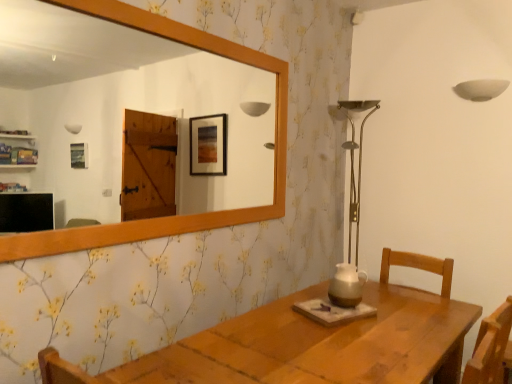
Question: Considering the relative sizes of wooden mirror at upper center and brown ceramic pitcher at center in the image provided, is wooden mirror at upper center thinner than brown ceramic pitcher at center?

Choices:
 (A) no
 (B) yes

Answer: (B)

Question: Is wooden mirror at upper center turned away from brown ceramic pitcher at center?

Choices:
 (A) yes
 (B) no

Answer: (B)

Question: Does wooden mirror at upper center come in front of brown ceramic pitcher at center?

Choices:
 (A) no
 (B) yes

Answer: (B)

Question: From a real-world perspective, is wooden mirror at upper center physically below brown ceramic pitcher at center?

Choices:
 (A) no
 (B) yes

Answer: (A)

Question: Is wooden mirror at upper center aimed at brown ceramic pitcher at center?

Choices:
 (A) no
 (B) yes

Answer: (A)

Question: Considering the relative positions of wooden mirror at upper center and brown ceramic pitcher at center in the image provided, is wooden mirror at upper center to the left of brown ceramic pitcher at center from the viewer's perspective?

Choices:
 (A) yes
 (B) no

Answer: (A)

Question: Is wooden mirror at upper center located within brown ceramic pitcher at center?

Choices:
 (A) yes
 (B) no

Answer: (B)

Question: Is wooden mirror at upper center at the back of brown ceramic pitcher at center?

Choices:
 (A) yes
 (B) no

Answer: (B)

Question: Can you confirm if brown ceramic pitcher at center is taller than wooden mirror at upper center?

Choices:
 (A) yes
 (B) no

Answer: (B)

Question: From the image's perspective, would you say brown ceramic pitcher at center is positioned over wooden mirror at upper center?

Choices:
 (A) no
 (B) yes

Answer: (A)

Question: Is brown ceramic pitcher at center positioned far away from wooden mirror at upper center?

Choices:
 (A) no
 (B) yes

Answer: (B)

Question: Considering the relative sizes of brown ceramic pitcher at center and wooden mirror at upper center in the image provided, is brown ceramic pitcher at center smaller than wooden mirror at upper center?

Choices:
 (A) no
 (B) yes

Answer: (B)

Question: Is brown ceramic pitcher at center inside or outside of wooden mirror at upper center?

Choices:
 (A) inside
 (B) outside

Answer: (B)